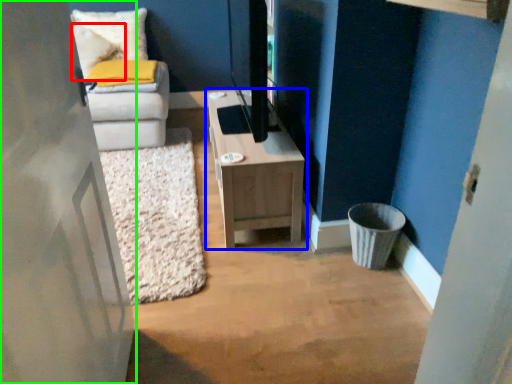
Question: Based on their relative distances, which object is farther from pillow (highlighted by a red box)? Choose from table (highlighted by a blue box) and door (highlighted by a green box).

Choices:
 (A) table
 (B) door

Answer: (B)